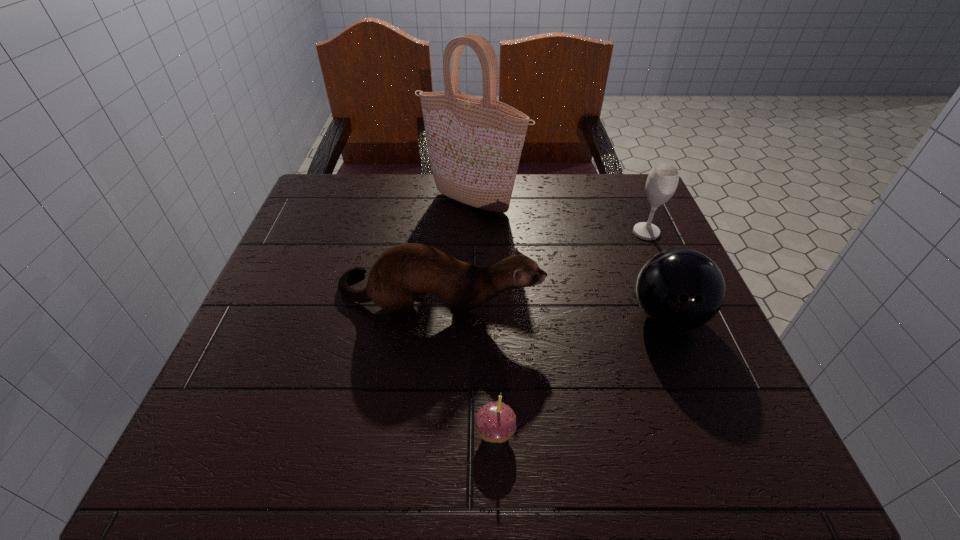
Identify the location of vacant region that satisfies the following two spatial constraints: 1. on the front side of the farthest object; 2. at the face of the ferret. This screenshot has width=960, height=540. (471, 299).

Image resolution: width=960 pixels, height=540 pixels. I want to click on vacant space that satisfies the following two spatial constraints: 1. on the front side of the tallest object; 2. at the face of the ferret, so click(471, 299).